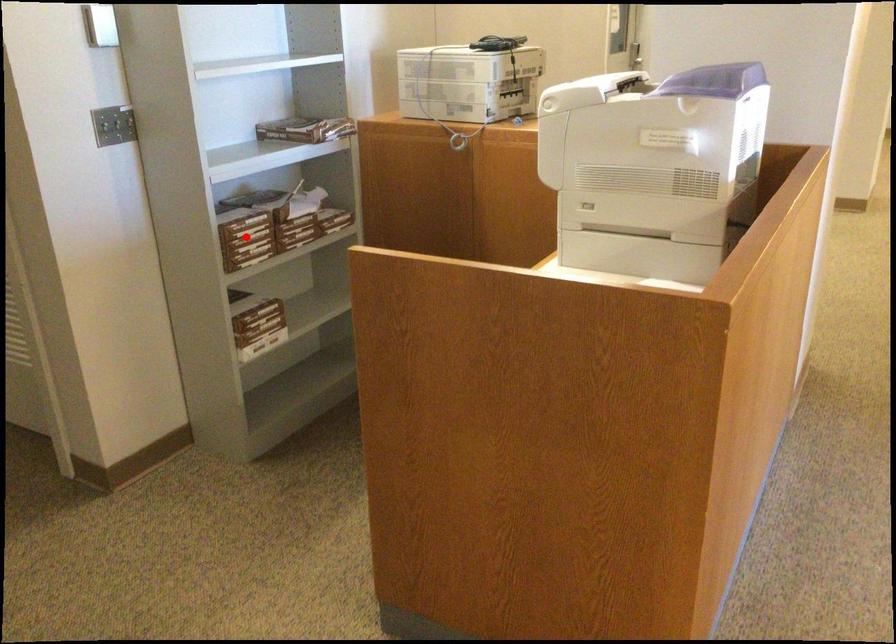
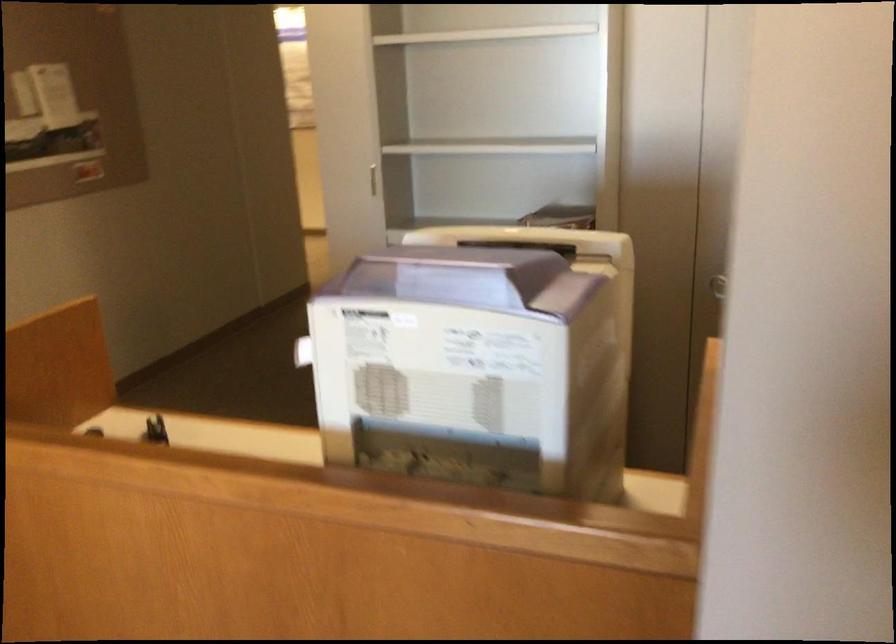
Question: I am providing you with two images of the same scene from different viewpoints. A red point is marked on the first image. Can you still see the location of the red point in image 2?

Choices:
 (A) Yes
 (B) No

Answer: (B)